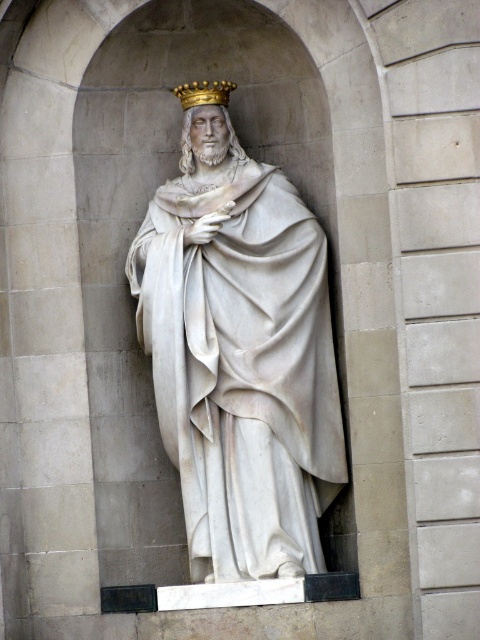
You are an art conservator examining the statue and its crown. You need to place a protective barrier around the golden crown at center. To ensure it doesn not accidentally get knocked over, should you position the barrier closer to the white marble statue at center or the other side?

The white marble statue at center is to the right of the golden crown at center, so you should position the barrier closer to the white marble statue at center to prevent the golden crown at center from being knocked over.